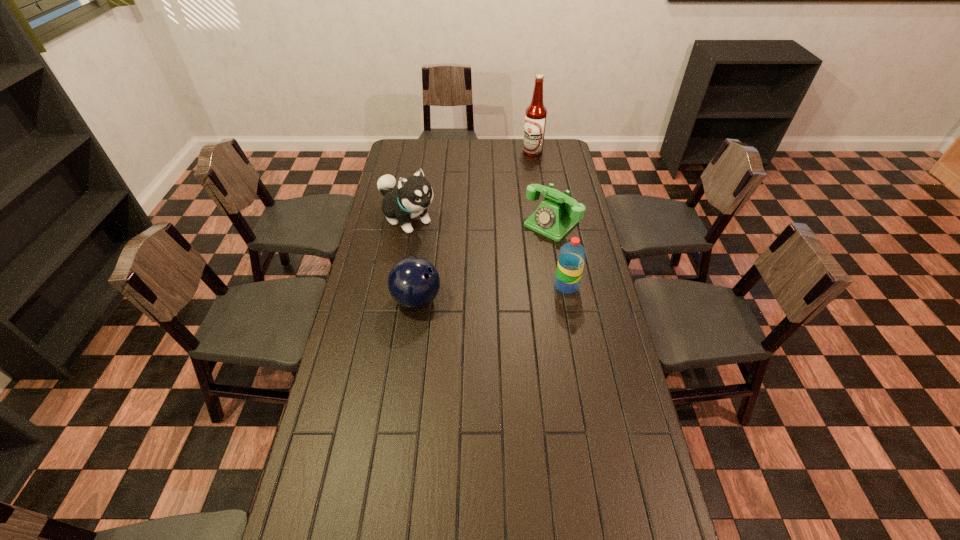
The height and width of the screenshot is (540, 960). What are the coordinates of `vacant space situated on the label side of the tallest object` in the screenshot? It's located at coord(520,182).

Locate an element on the screen. This screenshot has width=960, height=540. free space located 0.400m at the face of the puppy is located at coordinates (492, 286).

This screenshot has width=960, height=540. Find the location of `free space located at the face of the puppy`. free space located at the face of the puppy is located at coordinates (462, 262).

You are a GUI agent. You are given a task and a screenshot of the screen. Output one action in this format:
    pyautogui.click(x=<x>, y=<y>)
    Task: Click on the vacant space located at the face of the puppy
    
    Given the screenshot: What is the action you would take?
    pyautogui.click(x=492, y=286)

At what (x,y) coordinates should I click in order to perform the action: click on vacant space located on the dial of the telephone. Please return your answer as a coordinate pair (x, y). Looking at the image, I should click on (518, 254).

Locate an element on the screen. This screenshot has width=960, height=540. vacant space located 0.220m on the dial of the telephone is located at coordinates (505, 267).

This screenshot has width=960, height=540. In order to click on free space located on the dial of the telephone in this screenshot , I will do `click(527, 247)`.

Image resolution: width=960 pixels, height=540 pixels. Find the location of `object located at the far edge`. object located at the far edge is located at coordinates (536, 113).

Image resolution: width=960 pixels, height=540 pixels. Find the location of `bowling ball present at the left edge`. bowling ball present at the left edge is located at coordinates 414,282.

The width and height of the screenshot is (960, 540). In order to click on puppy positioned at the left edge in this screenshot , I will do point(414,194).